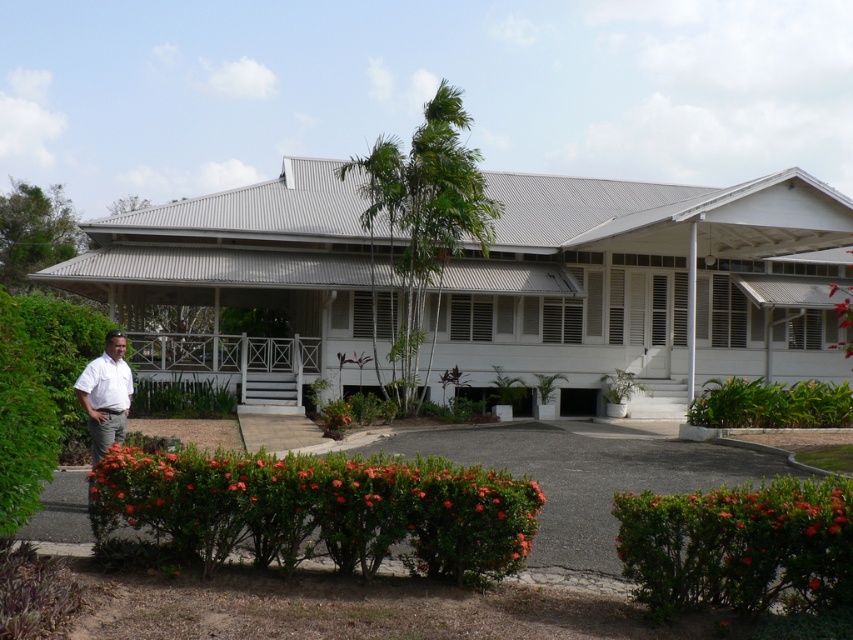
Which is behind, point (138, 368) or point (115, 371)?

Point (138, 368)

Which is below, white wooden porch at center or white shirt at left?

white shirt at left

Is point (283, 365) in front of point (109, 364)?

That is False.

Identify the location of white wooden porch at center. (231, 364).